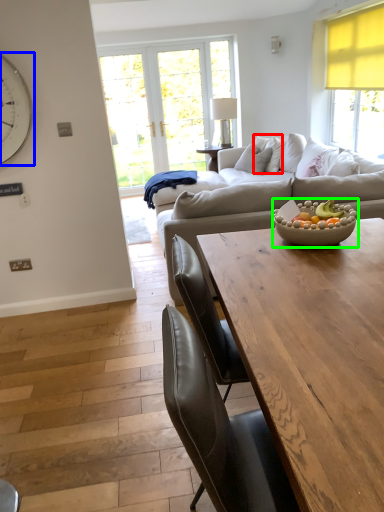
Question: Which object is positioned closest to pillow (highlighted by a red box)? Select from clock (highlighted by a blue box) and bowl (highlighted by a green box).

Choices:
 (A) clock
 (B) bowl

Answer: (B)